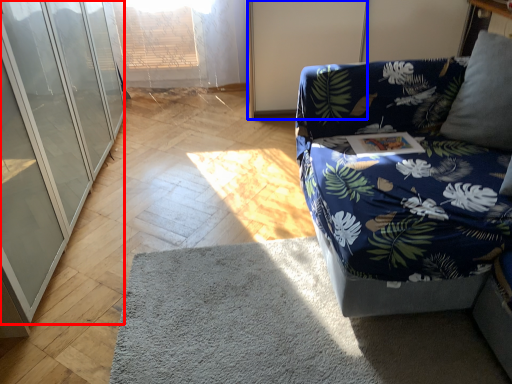
Question: Among these objects, which one is nearest to the camera, glass door (highlighted by a red box) or screen door (highlighted by a blue box)?

Choices:
 (A) glass door
 (B) screen door

Answer: (A)